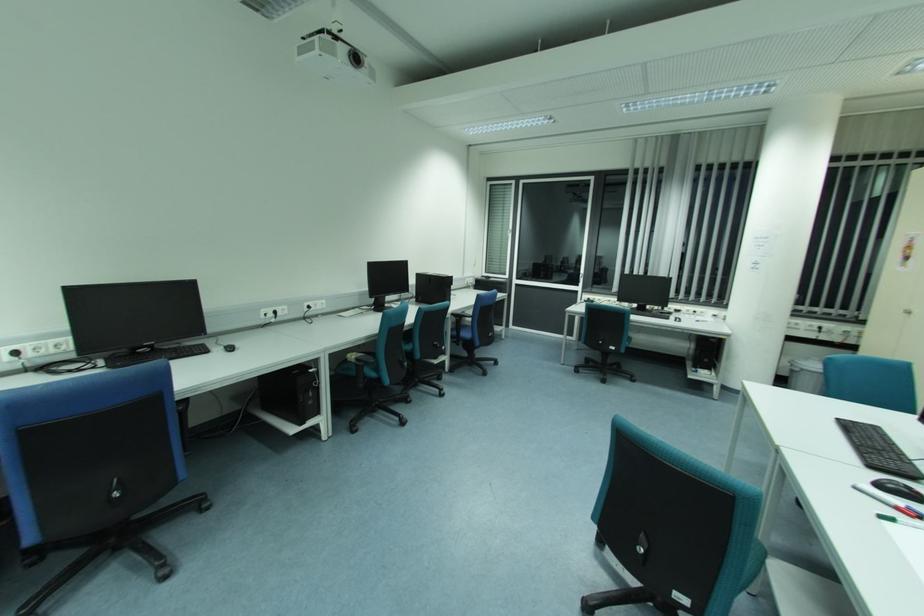
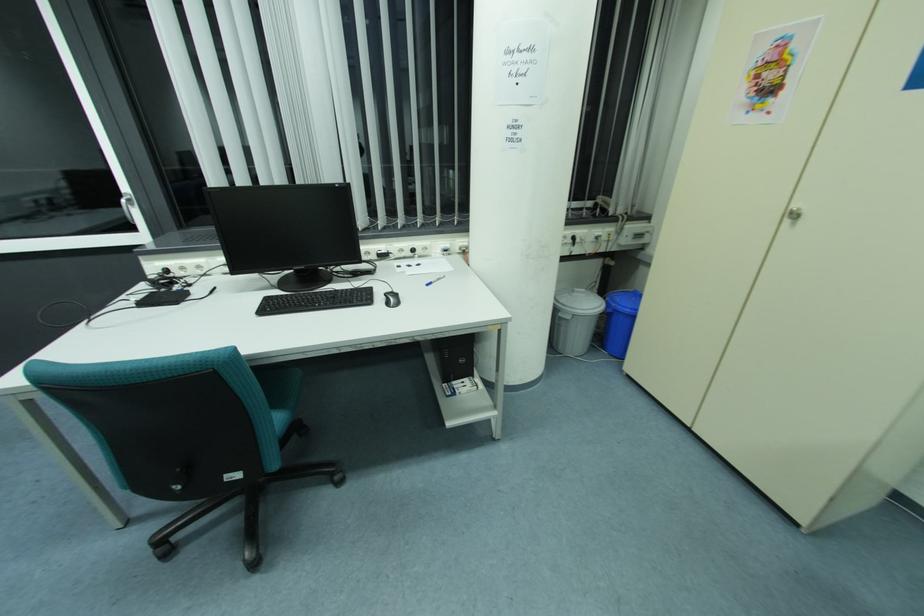
Find the pixel in the second image that matches point 707,361 in the first image.

(462, 361)